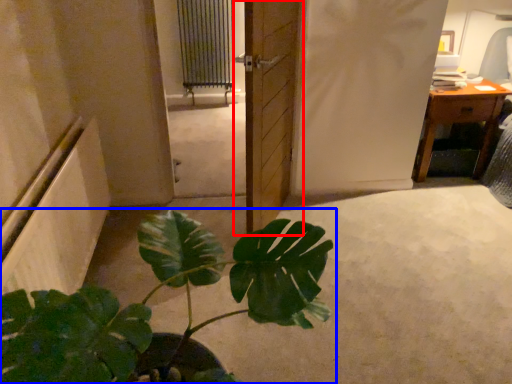
Question: Which of the following is the closest to the observer, door (highlighted by a red box) or houseplant (highlighted by a blue box)?

Choices:
 (A) door
 (B) houseplant

Answer: (B)